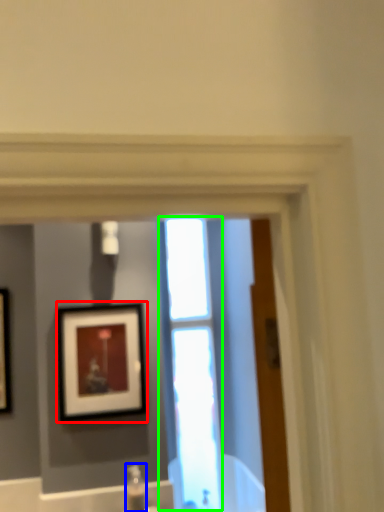
Question: Which is nearer to the picture frame (highlighted by a red box)? plumbing fixture (highlighted by a blue box) or window (highlighted by a green box).

Choices:
 (A) plumbing fixture
 (B) window

Answer: (B)